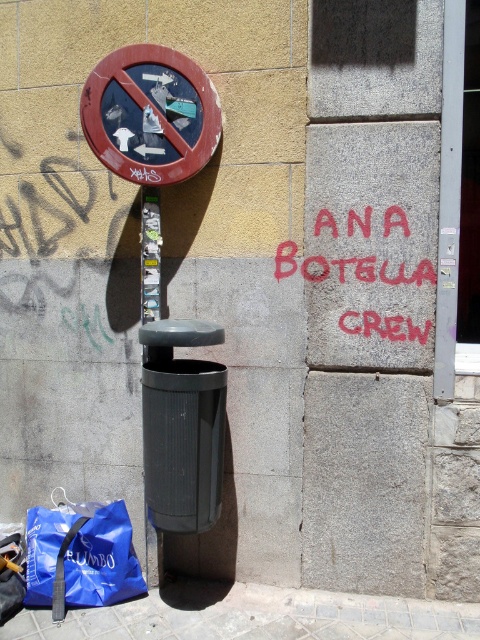
Which of these two, blue fabric bag at lower left or red graffiti at center, stands taller?

red graffiti at center is taller.

The height and width of the screenshot is (640, 480). Describe the element at coordinates (81, 556) in the screenshot. I see `blue fabric bag at lower left` at that location.

At what (x,y) coordinates should I click in order to perform the action: click on blue fabric bag at lower left. Please return your answer as a coordinate pair (x, y). The height and width of the screenshot is (640, 480). Looking at the image, I should click on (81, 556).

Does blue fabric bag at lower left have a smaller size compared to brushed metal pole at center?

Incorrect, blue fabric bag at lower left is not smaller in size than brushed metal pole at center.

Does blue fabric bag at lower left have a greater height compared to brushed metal pole at center?

No.

Measure the distance between blue fabric bag at lower left and camera.

9.55 feet

Locate an element on the screen. The width and height of the screenshot is (480, 640). blue fabric bag at lower left is located at coordinates (81, 556).

Is gray concrete pavement at lower center in front of blue fabric bag at lower left?

Yes.

Is gray concrete pavement at lower center taller than blue fabric bag at lower left?

In fact, gray concrete pavement at lower center may be shorter than blue fabric bag at lower left.

This screenshot has height=640, width=480. What do you see at coordinates (252, 616) in the screenshot?
I see `gray concrete pavement at lower center` at bounding box center [252, 616].

Image resolution: width=480 pixels, height=640 pixels. Find the location of `gray concrete pavement at lower center`. gray concrete pavement at lower center is located at coordinates (252, 616).